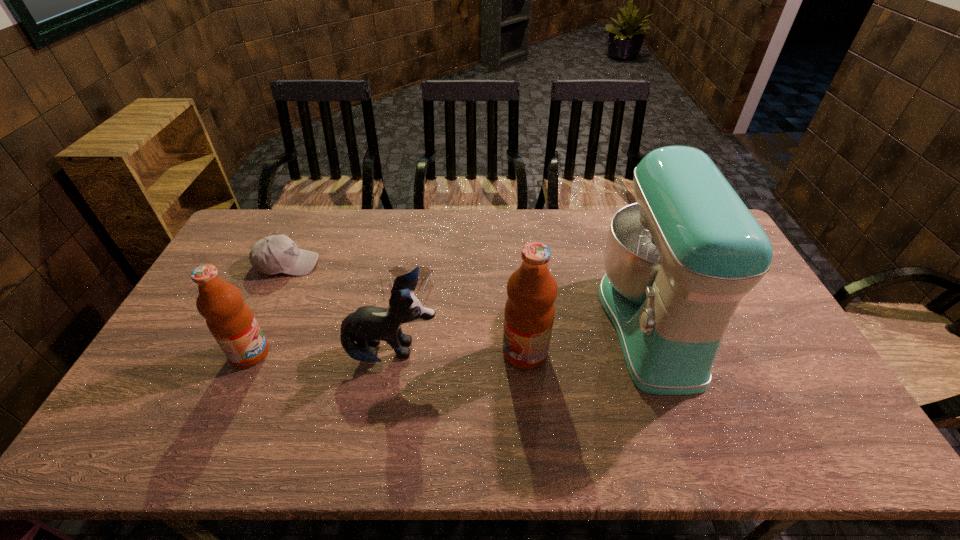
Where is `vacant area that lies between the left fruit juice and the fifth object from left to right`? vacant area that lies between the left fruit juice and the fifth object from left to right is located at coordinates (388, 353).

At what (x,y) coordinates should I click in order to perform the action: click on blank region between the right fruit juice and the puppy. Please return your answer as a coordinate pair (x, y). The width and height of the screenshot is (960, 540). Looking at the image, I should click on (459, 353).

Locate an element on the screen. The height and width of the screenshot is (540, 960). vacant area that lies between the fifth tallest object and the shortest object is located at coordinates (349, 276).

Locate an element on the screen. The height and width of the screenshot is (540, 960). object identified as the fourth closest to the baseball cap is located at coordinates (529, 313).

Locate an element on the screen. This screenshot has height=540, width=960. object that ranks as the second closest to the rightmost object is located at coordinates (368, 325).

I want to click on free space that satisfies the following two spatial constraints: 1. on the front-facing side of the shortest object; 2. on the front-facing side of the puppy, so click(x=400, y=353).

The image size is (960, 540). Find the location of `vacant space that satisfies the following two spatial constraints: 1. on the front-facing side of the spectacles; 2. on the front-facing side of the puppy`. vacant space that satisfies the following two spatial constraints: 1. on the front-facing side of the spectacles; 2. on the front-facing side of the puppy is located at coordinates (400, 353).

The height and width of the screenshot is (540, 960). What are the coordinates of `free space that satisfies the following two spatial constraints: 1. on the front-facing side of the shortest object; 2. on the front-facing side of the puppy` in the screenshot? It's located at (400, 353).